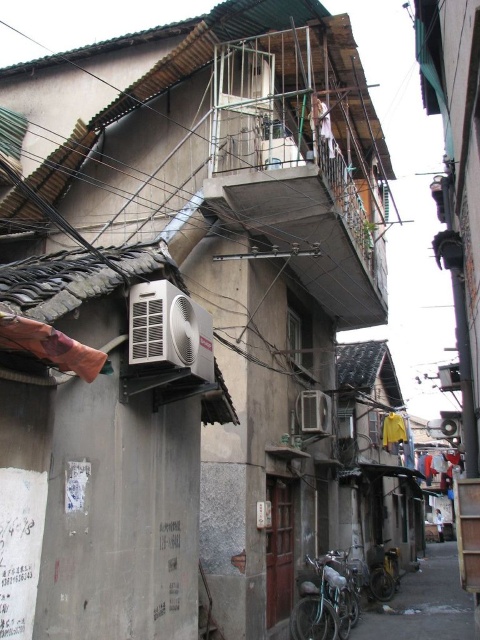
You are a delivery person trying to navigate through the narrow alleyway. You see a silver metallic air conditioner at center and a white plastic air conditioner at lower right. Which air conditioner is taller?

The silver metallic air conditioner at center is taller than the white plastic air conditioner at lower right.

You are a technician who needs to replace the air conditioner units in the alley. You have a ladder that can reach up to 2 meters. The silver metallic air conditioner at center is mounted lower than the white plastic air conditioner at upper center. Can you safely reach both units with your ladder?

The silver metallic air conditioner at center is shorter than the white plastic air conditioner at upper center. Since the ladder can reach up to 2 meters, you can safely reach both units if their heights are within the ladder capacity. However, the exact height of each unit isn